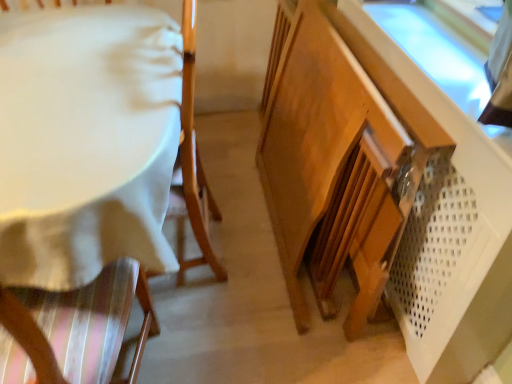
Describe the element at coordinates (388, 197) in the screenshot. The width and height of the screenshot is (512, 384). I see `wooden cabinet at lower right` at that location.

The image size is (512, 384). I want to click on wooden cabinet at lower right, so click(388, 197).

Describe the element at coordinates (86, 141) in the screenshot. I see `white fabric-covered table at left` at that location.

Image resolution: width=512 pixels, height=384 pixels. Find the location of `white fabric-covered table at left`. white fabric-covered table at left is located at coordinates (86, 141).

In order to face white fabric-covered table at left, should I rotate leftwards or rightwards?

You should rotate left by 14.776 degrees.

Locate an element on the screen. Image resolution: width=512 pixels, height=384 pixels. wooden cabinet at lower right is located at coordinates (388, 197).

Considering the relative positions of wooden cabinet at lower right and white fabric-covered table at left in the image provided, is wooden cabinet at lower right to the left or to the right of white fabric-covered table at left?

Based on their positions, wooden cabinet at lower right is located to the right of white fabric-covered table at left.

Which object is further away from the camera, wooden cabinet at lower right or white fabric-covered table at left?

white fabric-covered table at left is more distant.

Which is farther, (275, 135) or (80, 284)?

The point (275, 135) is farther.

From the image's perspective, is wooden cabinet at lower right located above or below white fabric-covered table at left?

wooden cabinet at lower right is below white fabric-covered table at left.

From a real-world perspective, is wooden cabinet at lower right located higher than white fabric-covered table at left?

No, from a real-world perspective, wooden cabinet at lower right is not over white fabric-covered table at left

Considering the sizes of objects wooden cabinet at lower right and white fabric-covered table at left in the image provided, who is wider, wooden cabinet at lower right or white fabric-covered table at left?

With larger width is white fabric-covered table at left.

Considering the sizes of objects wooden cabinet at lower right and white fabric-covered table at left in the image provided, who is shorter, wooden cabinet at lower right or white fabric-covered table at left?

Standing shorter between the two is wooden cabinet at lower right.

Is wooden cabinet at lower right smaller than white fabric-covered table at left?

No.

Is white fabric-covered table at left a part of wooden cabinet at lower right?

That's incorrect, white fabric-covered table at left is not inside wooden cabinet at lower right.

Is wooden cabinet at lower right with white fabric-covered table at left?

No, wooden cabinet at lower right is not touching white fabric-covered table at left.

Is white fabric-covered table at left at the back of wooden cabinet at lower right?

That's right, wooden cabinet at lower right is facing away from white fabric-covered table at left.

How far apart are wooden cabinet at lower right and white fabric-covered table at left?

The distance of wooden cabinet at lower right from white fabric-covered table at left is 24.81 inches.

The width and height of the screenshot is (512, 384). I want to click on cabinetry below the white fabric-covered table at left (from the image's perspective), so click(x=388, y=197).

Considering the positions of objects white fabric-covered table at left and wooden cabinet at lower right in the image provided, who is more to the right, white fabric-covered table at left or wooden cabinet at lower right?

wooden cabinet at lower right.

Is white fabric-covered table at left positioned behind wooden cabinet at lower right?

That is True.

Is point (119, 111) closer to viewer compared to point (301, 12)?

That is True.

From the image's perspective, is white fabric-covered table at left under wooden cabinet at lower right?

No, from the image's perspective, white fabric-covered table at left is not beneath wooden cabinet at lower right.

From a real-world perspective, is white fabric-covered table at left beneath wooden cabinet at lower right?

No, from a real-world perspective, white fabric-covered table at left is not under wooden cabinet at lower right.

Which of these two, white fabric-covered table at left or wooden cabinet at lower right, is thinner?

wooden cabinet at lower right is thinner.

In the scene shown: Considering the relative sizes of white fabric-covered table at left and wooden cabinet at lower right in the image provided, is white fabric-covered table at left taller than wooden cabinet at lower right?

Yes.

Is white fabric-covered table at left smaller than wooden cabinet at lower right?

Correct, white fabric-covered table at left occupies less space than wooden cabinet at lower right.

Is white fabric-covered table at left located outside wooden cabinet at lower right?

That's correct, white fabric-covered table at left is outside of wooden cabinet at lower right.

Is white fabric-covered table at left next to wooden cabinet at lower right?

No, white fabric-covered table at left is not with wooden cabinet at lower right.

Is white fabric-covered table at left turned away from wooden cabinet at lower right?

Correct, white fabric-covered table at left is looking away from wooden cabinet at lower right.

What's the angular difference between white fabric-covered table at left and wooden cabinet at lower right's facing directions?

white fabric-covered table at left and wooden cabinet at lower right are facing 2.83 degrees away from each other.

Identify the location of cabinetry that is in front of the white fabric-covered table at left. (388, 197).

Locate an element on the screen. The width and height of the screenshot is (512, 384). cabinetry located below the white fabric-covered table at left (from the image's perspective) is located at coordinates (388, 197).

Where is `table above the wooden cabinet at lower right (from the image's perspective)`? The image size is (512, 384). table above the wooden cabinet at lower right (from the image's perspective) is located at coordinates (86, 141).